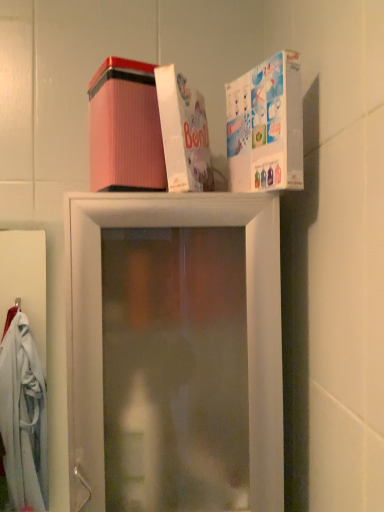
The height and width of the screenshot is (512, 384). What do you see at coordinates (125, 128) in the screenshot?
I see `pink corrugated box at upper center, arranged as the 3th box when viewed from the right` at bounding box center [125, 128].

In order to face white cardboard box at upper center, which is the second box in left-to-right order, should I rotate leftwards or rightwards?

To align with it, rotate left about 0.299°.

I want to click on pink corrugated box at upper center, arranged as the 3th box when viewed from the right, so click(125, 128).

Which object is closer to the camera, white glossy box at upper right, the 3th box viewed from the left, or pink corrugated box at upper center, arranged as the 3th box when viewed from the right?

white glossy box at upper right, the 3th box viewed from the left, is in front.

Does white glossy box at upper right, which is the first box in right-to-left order, touch pink corrugated box at upper center, the first box positioned from the left?

No, white glossy box at upper right, which is the first box in right-to-left order, is not next to pink corrugated box at upper center, the first box positioned from the left.

Considering the positions of point (253, 129) and point (100, 138), is point (253, 129) closer or farther from the camera than point (100, 138)?

Point (253, 129) appears to be closer to the viewer than point (100, 138).

How many degrees apart are the facing directions of white glossy box at upper right, which is the first box in right-to-left order, and pink corrugated box at upper center, the first box positioned from the left?

The angular difference between white glossy box at upper right, which is the first box in right-to-left order, and pink corrugated box at upper center, the first box positioned from the left, is 62.4 degrees.

Does point (149, 123) lie behind point (252, 495)?

Yes.

Is pink corrugated box at upper center, arranged as the 3th box when viewed from the right, beside transparent plastic shelf at upper center?

There is a gap between pink corrugated box at upper center, arranged as the 3th box when viewed from the right, and transparent plastic shelf at upper center.

Based on the photo, between pink corrugated box at upper center, the first box positioned from the left, and transparent plastic shelf at upper center, which one is positioned in front?

transparent plastic shelf at upper center.

Looking at this image, from the image's perspective, which one is positioned higher, pink corrugated box at upper center, the first box positioned from the left, or transparent plastic shelf at upper center?

From the image's view, pink corrugated box at upper center, the first box positioned from the left, is above.

Would you say white cardboard box at upper center, placed as the 2th box when sorted from right to left, contains pink corrugated box at upper center, arranged as the 3th box when viewed from the right?

No, pink corrugated box at upper center, arranged as the 3th box when viewed from the right, is not inside white cardboard box at upper center, placed as the 2th box when sorted from right to left.

Considering the sizes of objects white cardboard box at upper center, which is the second box in left-to-right order, and pink corrugated box at upper center, arranged as the 3th box when viewed from the right, in the image provided, who is thinner, white cardboard box at upper center, which is the second box in left-to-right order, or pink corrugated box at upper center, arranged as the 3th box when viewed from the right,?

pink corrugated box at upper center, arranged as the 3th box when viewed from the right.

From the image's perspective, which one is positioned lower, white cardboard box at upper center, which is the second box in left-to-right order, or pink corrugated box at upper center, the first box positioned from the left?

pink corrugated box at upper center, the first box positioned from the left, is shown below in the image.

Which is behind, point (206, 124) or point (98, 139)?

The point (206, 124) is more distant.

Is point (157, 172) positioned before point (163, 68)?

No.

Is pink corrugated box at upper center, arranged as the 3th box when viewed from the right, positioned with its back to white cardboard box at upper center, placed as the 2th box when sorted from right to left?

No, pink corrugated box at upper center, arranged as the 3th box when viewed from the right, is not facing away from white cardboard box at upper center, placed as the 2th box when sorted from right to left.

From the picture: Can you confirm if pink corrugated box at upper center, arranged as the 3th box when viewed from the right, is smaller than white cardboard box at upper center, which is the second box in left-to-right order?

Incorrect, pink corrugated box at upper center, arranged as the 3th box when viewed from the right, is not smaller in size than white cardboard box at upper center, which is the second box in left-to-right order.

Is the depth of pink corrugated box at upper center, arranged as the 3th box when viewed from the right, less than that of white cardboard box at upper center, which is the second box in left-to-right order?

No, it is not.

Considering the sizes of objects white glossy box at upper right, which is the first box in right-to-left order, and transparent plastic shelf at upper center in the image provided, who is bigger, white glossy box at upper right, which is the first box in right-to-left order, or transparent plastic shelf at upper center?

transparent plastic shelf at upper center is bigger.

From the image's perspective, which one is positioned lower, white glossy box at upper right, the 3th box viewed from the left, or transparent plastic shelf at upper center?

transparent plastic shelf at upper center appears lower in the image.

Considering the points (226, 118) and (232, 402), which point is in front, point (226, 118) or point (232, 402)?

The point (232, 402) is closer to the camera.

Locate an element on the screen. This screenshot has width=384, height=512. box in front of the transparent plastic shelf at upper center is located at coordinates (266, 126).

Considering the positions of objects pink corrugated box at upper center, the first box positioned from the left, and white glossy box at upper right, which is the first box in right-to-left order, in the image provided, who is more to the left, pink corrugated box at upper center, the first box positioned from the left, or white glossy box at upper right, which is the first box in right-to-left order,?

From the viewer's perspective, pink corrugated box at upper center, the first box positioned from the left, appears more on the left side.

Is pink corrugated box at upper center, arranged as the 3th box when viewed from the right, oriented away from white glossy box at upper right, which is the first box in right-to-left order?

pink corrugated box at upper center, arranged as the 3th box when viewed from the right, does not have its back to white glossy box at upper right, which is the first box in right-to-left order.

Considering the points (109, 120) and (254, 135), which point is behind, point (109, 120) or point (254, 135)?

The point (254, 135) is more distant.

Is pink corrugated box at upper center, arranged as the 3th box when viewed from the right, thinner than white glossy box at upper right, which is the first box in right-to-left order?

No, pink corrugated box at upper center, arranged as the 3th box when viewed from the right, is not thinner than white glossy box at upper right, which is the first box in right-to-left order.

Is white glossy box at upper right, the 3th box viewed from the left, positioned with its back to white cardboard box at upper center, placed as the 2th box when sorted from right to left?

No, white glossy box at upper right, the 3th box viewed from the left,'s orientation is not away from white cardboard box at upper center, placed as the 2th box when sorted from right to left.

Is white glossy box at upper right, the 3th box viewed from the left, to the left of white cardboard box at upper center, which is the second box in left-to-right order, from the viewer's perspective?

Incorrect, white glossy box at upper right, the 3th box viewed from the left, is not on the left side of white cardboard box at upper center, which is the second box in left-to-right order.

Between white glossy box at upper right, the 3th box viewed from the left, and white cardboard box at upper center, placed as the 2th box when sorted from right to left, which one has larger width?

Wider between the two is white cardboard box at upper center, placed as the 2th box when sorted from right to left.

Based on the photo, is white glossy box at upper right, the 3th box viewed from the left, with white cardboard box at upper center, placed as the 2th box when sorted from right to left?

Yes, white glossy box at upper right, the 3th box viewed from the left, is touching white cardboard box at upper center, placed as the 2th box when sorted from right to left.

From the image's perspective, starting from the white glossy box at upper right, which is the first box in right-to-left order, which box is the 1st one above? Please provide its 2D coordinates.

[(125, 128)]

Which box is the 2nd one when counting from the back of the transparent plastic shelf at upper center? Please provide its 2D coordinates.

[(125, 128)]

Estimate the real-world distances between objects in this image. Which object is closer to white glossy box at upper right, the 3th box viewed from the left, white cardboard box at upper center, placed as the 2th box when sorted from right to left, or pink corrugated box at upper center, arranged as the 3th box when viewed from the right?

Among the two, white cardboard box at upper center, placed as the 2th box when sorted from right to left, is located nearer to white glossy box at upper right, the 3th box viewed from the left.

Looking at the image, which one is located closer to white cardboard box at upper center, placed as the 2th box when sorted from right to left, white glossy box at upper right, the 3th box viewed from the left, or transparent plastic shelf at upper center?

Based on the image, white glossy box at upper right, the 3th box viewed from the left, appears to be nearer to white cardboard box at upper center, placed as the 2th box when sorted from right to left.

From the image, which object appears to be nearer to pink corrugated box at upper center, the first box positioned from the left, white glossy box at upper right, which is the first box in right-to-left order, or transparent plastic shelf at upper center?

Among the two, white glossy box at upper right, which is the first box in right-to-left order, is located nearer to pink corrugated box at upper center, the first box positioned from the left.

From the image, which object appears to be nearer to white glossy box at upper right, the 3th box viewed from the left, white cardboard box at upper center, placed as the 2th box when sorted from right to left, or transparent plastic shelf at upper center?

white cardboard box at upper center, placed as the 2th box when sorted from right to left, is positioned closer to the anchor white glossy box at upper right, the 3th box viewed from the left.

When comparing their distances from transparent plastic shelf at upper center, does pink corrugated box at upper center, arranged as the 3th box when viewed from the right, or white glossy box at upper right, which is the first box in right-to-left order, seem closer?

Based on the image, pink corrugated box at upper center, arranged as the 3th box when viewed from the right, appears to be nearer to transparent plastic shelf at upper center.

Estimate the real-world distances between objects in this image. Which object is closer to white glossy box at upper right, the 3th box viewed from the left, pink corrugated box at upper center, the first box positioned from the left, or transparent plastic shelf at upper center?

pink corrugated box at upper center, the first box positioned from the left, lies closer to white glossy box at upper right, the 3th box viewed from the left, than the other object.

Looking at the image, which one is located closer to transparent plastic shelf at upper center, white glossy box at upper right, which is the first box in right-to-left order, or white cardboard box at upper center, which is the second box in left-to-right order?

The object closer to transparent plastic shelf at upper center is white cardboard box at upper center, which is the second box in left-to-right order.

Based on their spatial positions, is white glossy box at upper right, which is the first box in right-to-left order, or pink corrugated box at upper center, arranged as the 3th box when viewed from the right, closer to transparent plastic shelf at upper center?

Based on the image, pink corrugated box at upper center, arranged as the 3th box when viewed from the right, appears to be nearer to transparent plastic shelf at upper center.

The width and height of the screenshot is (384, 512). Find the location of `box located between pink corrugated box at upper center, arranged as the 3th box when viewed from the right, and white glossy box at upper right, which is the first box in right-to-left order, in the left-right direction`. box located between pink corrugated box at upper center, arranged as the 3th box when viewed from the right, and white glossy box at upper right, which is the first box in right-to-left order, in the left-right direction is located at coordinates (183, 133).

Identify the location of box that lies between pink corrugated box at upper center, the first box positioned from the left, and transparent plastic shelf at upper center from top to bottom. Image resolution: width=384 pixels, height=512 pixels. (266, 126).